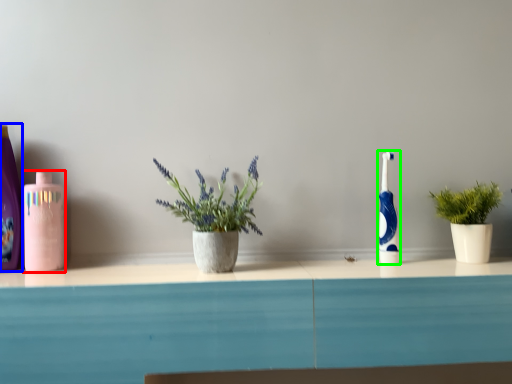
Question: Estimate the real-world distances between objects in this image. Which object is farther from mouthwash (highlighted by a red box), cleaning product (highlighted by a blue box) or toothbrush (highlighted by a green box)?

Choices:
 (A) cleaning product
 (B) toothbrush

Answer: (B)